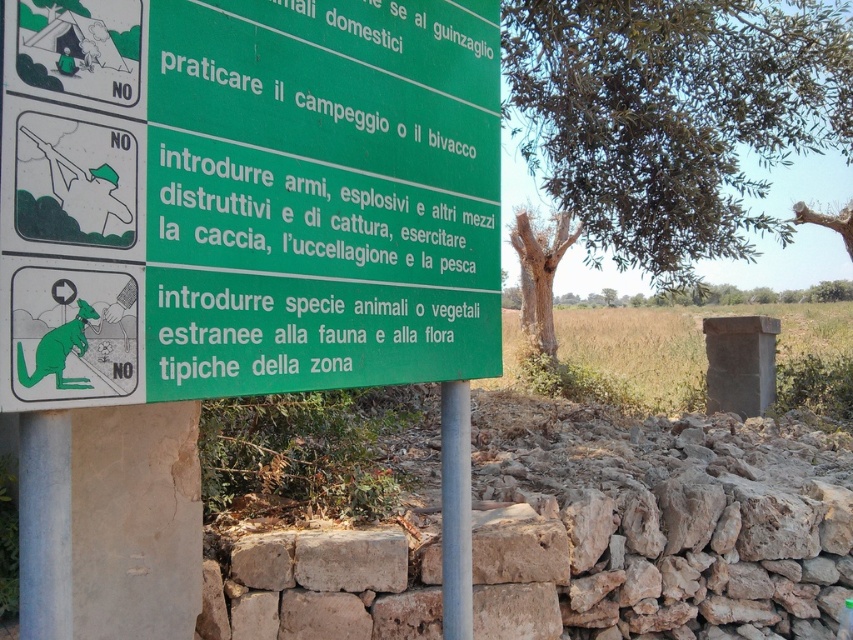
You are a hiker planning to set up camp near the signboard. You notice two trees, the green leafy tree at upper center and the brown textured tree at upper right. Which tree is positioned higher up in the image?

The green leafy tree at upper center is positioned higher up in the image than the brown textured tree at upper right.